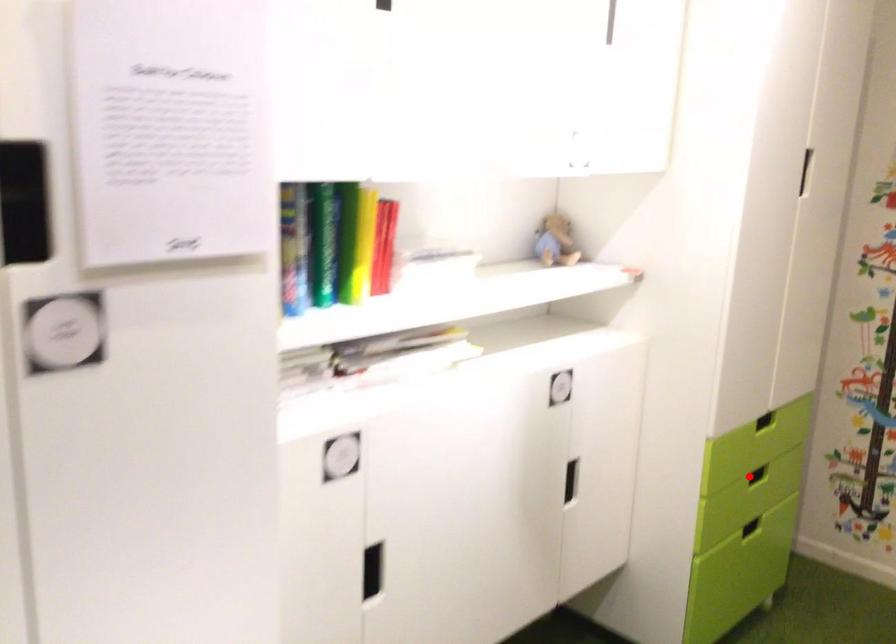
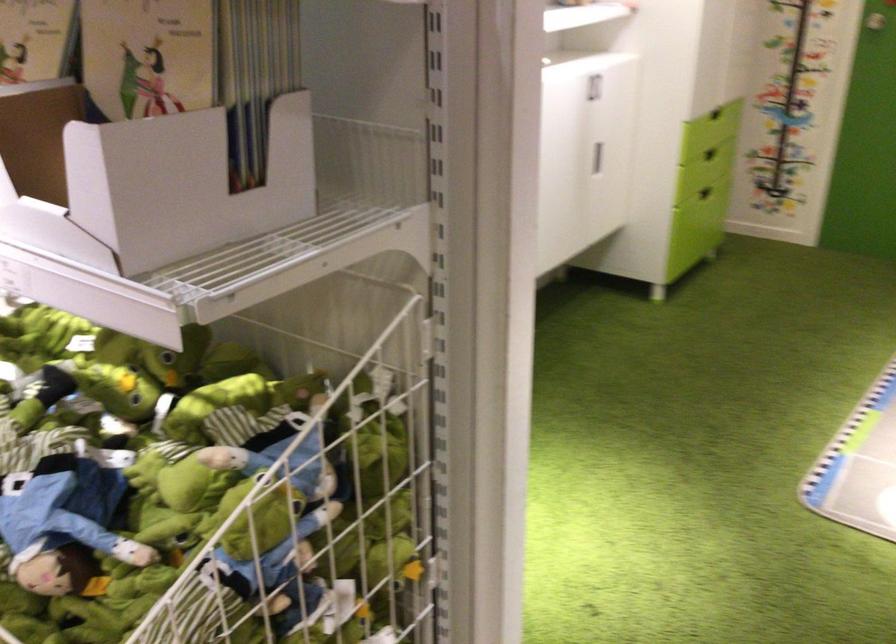
Question: I am providing you with two images of the same scene from different viewpoints. Image1 has a red point marked. In image2, the corresponding 3D location appears at what relative position? Reply with the corresponding letter.

Choices:
 (A) Closer
 (B) Farther

Answer: (B)